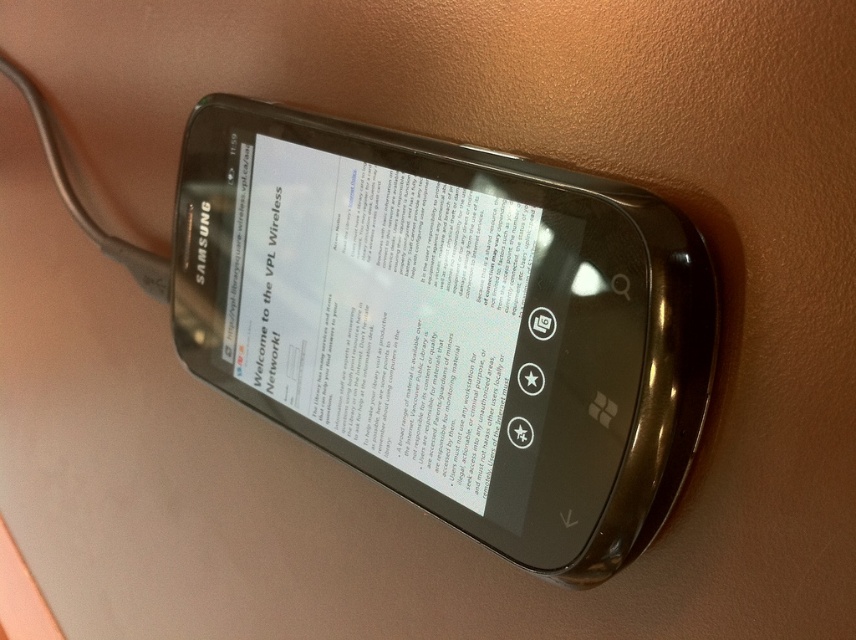
Question: Which object is farther from the camera taking this photo?

Choices:
 (A) white glossy paper at center
 (B) metallic glossy smartphone at center

Answer: (A)

Question: From the image, what is the correct spatial relationship of metallic glossy smartphone at center in relation to white glossy paper at center?

Choices:
 (A) below
 (B) above

Answer: (A)

Question: Which point is farther to the camera?

Choices:
 (A) (254, 122)
 (B) (325, 385)

Answer: (A)

Question: Which point is farther to the camera?

Choices:
 (A) white glossy paper at center
 (B) metallic glossy smartphone at center

Answer: (A)

Question: Considering the relative positions of metallic glossy smartphone at center and white glossy paper at center in the image provided, where is metallic glossy smartphone at center located with respect to white glossy paper at center?

Choices:
 (A) below
 (B) above

Answer: (A)

Question: Is metallic glossy smartphone at center wider than white glossy paper at center?

Choices:
 (A) no
 (B) yes

Answer: (B)